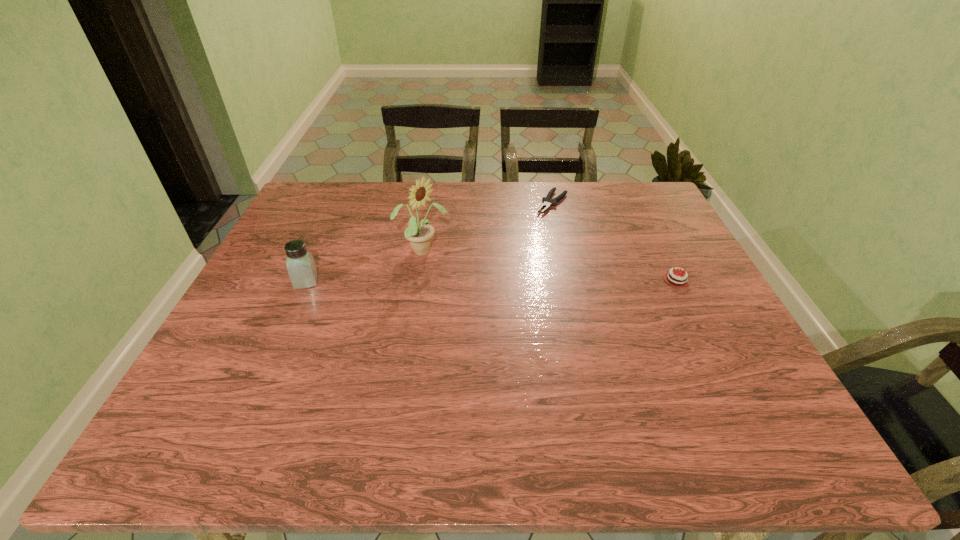
Identify the location of free space located on the front-facing side of the third object from right to left. The width and height of the screenshot is (960, 540). (504, 290).

At what (x,y) coordinates should I click in order to perform the action: click on free location located on the front-facing side of the third object from right to left. Please return your answer as a coordinate pair (x, y). The image size is (960, 540). Looking at the image, I should click on (501, 288).

Image resolution: width=960 pixels, height=540 pixels. What are the coordinates of `vacant area situated 0.080m on the front-facing side of the third object from right to left` in the screenshot? It's located at (465, 270).

This screenshot has height=540, width=960. What are the coordinates of `free space located 0.060m at the gripping part of the third object from left to right` in the screenshot? It's located at (538, 223).

Where is `vacant space located at the gripping part of the third object from left to right`? The image size is (960, 540). vacant space located at the gripping part of the third object from left to right is located at coordinates (480, 286).

Locate an element on the screen. blank space located at the gripping part of the third object from left to right is located at coordinates (539, 221).

Where is `object located at the far edge`? object located at the far edge is located at coordinates (546, 203).

Image resolution: width=960 pixels, height=540 pixels. I want to click on object present at the left edge, so click(x=301, y=267).

Where is `object that is at the right edge`? The height and width of the screenshot is (540, 960). object that is at the right edge is located at coordinates (672, 278).

In the image, there is a desktop. Identify the location of vacant space at the far edge. (476, 212).